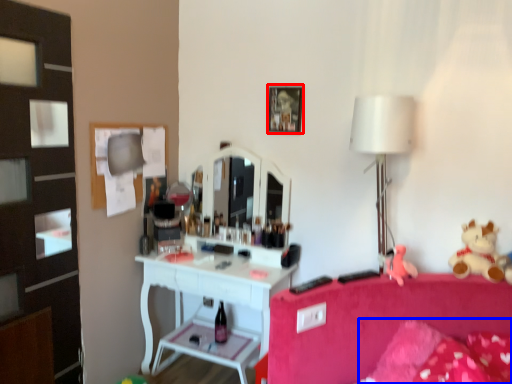
Question: Among these objects, which one is nearest to the camera, picture frame (highlighted by a red box) or pillow (highlighted by a blue box)?

Choices:
 (A) picture frame
 (B) pillow

Answer: (B)